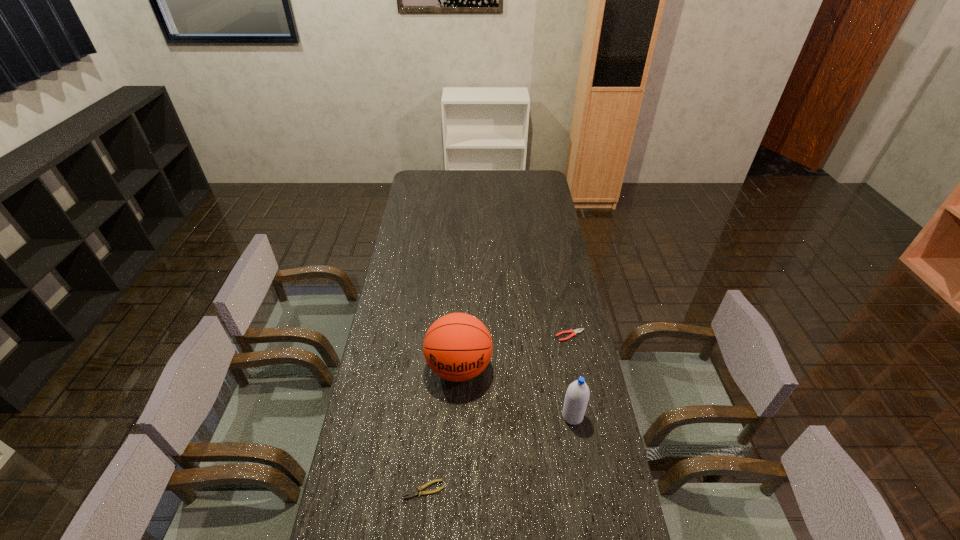
Identify the location of water bottle that is at the right edge. (577, 396).

I want to click on pliers that is at the right edge, so click(x=574, y=332).

The height and width of the screenshot is (540, 960). I want to click on vacant space at the far edge of the desktop, so click(483, 182).

I want to click on free space at the left edge, so click(x=393, y=521).

The height and width of the screenshot is (540, 960). Identify the location of vacant space at the right edge. coord(535,193).

The width and height of the screenshot is (960, 540). What are the coordinates of `free space at the far left corner of the desktop` in the screenshot? It's located at point(425,178).

Identify the location of vacant area between the third tallest object and the third nearest object. (515, 352).

Find the location of `empty location between the water bottle and the farthest object`. empty location between the water bottle and the farthest object is located at coordinates (571, 376).

What are the coordinates of `vacant area between the second nearest object and the basketball` in the screenshot? It's located at (516, 392).

You are a GUI agent. You are given a task and a screenshot of the screen. Output one action in this format:
    pyautogui.click(x=<x>, y=<y>)
    Task: Click on the unoccupied area between the taller pliers and the third farthest object
    Image resolution: width=960 pixels, height=540 pixels.
    Given the screenshot: What is the action you would take?
    pyautogui.click(x=571, y=376)